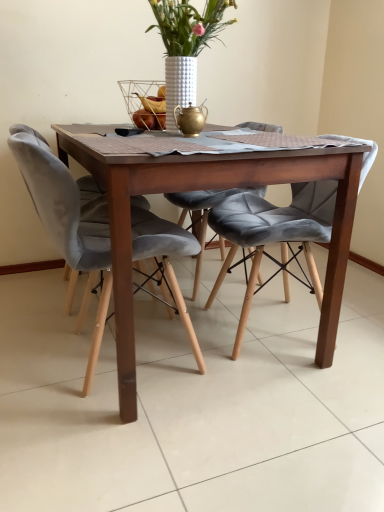
Question: Is white textured vase at upper center beside wooden table at center?

Choices:
 (A) yes
 (B) no

Answer: (B)

Question: Does white textured vase at upper center appear on the left side of wooden table at center?

Choices:
 (A) no
 (B) yes

Answer: (A)

Question: Is wooden table at center a part of white textured vase at upper center?

Choices:
 (A) yes
 (B) no

Answer: (B)

Question: Is white textured vase at upper center thinner than wooden table at center?

Choices:
 (A) yes
 (B) no

Answer: (A)

Question: From a real-world perspective, is white textured vase at upper center located beneath wooden table at center?

Choices:
 (A) yes
 (B) no

Answer: (B)

Question: Is wooden table at center wider or thinner than velvet grey chair at left, the 1th chair in the left-to-right sequence?

Choices:
 (A) thin
 (B) wide

Answer: (B)

Question: From their relative heights in the image, would you say wooden table at center is taller or shorter than velvet grey chair at left, the 2th chair from the right?

Choices:
 (A) short
 (B) tall

Answer: (A)

Question: Choose the correct answer: Is wooden table at center inside velvet grey chair at left, the 1th chair in the left-to-right sequence, or outside it?

Choices:
 (A) outside
 (B) inside

Answer: (A)

Question: Is wooden table at center bigger or smaller than velvet grey chair at left, the 1th chair in the left-to-right sequence?

Choices:
 (A) small
 (B) big

Answer: (B)

Question: Is velvet grey chair at left, the 2th chair from the right, situated inside wooden table at center or outside?

Choices:
 (A) inside
 (B) outside

Answer: (A)

Question: From a real-world perspective, relative to wooden table at center, is velvet grey chair at left, the 1th chair in the left-to-right sequence, vertically above or below?

Choices:
 (A) below
 (B) above

Answer: (B)

Question: Is point (178, 303) positioned closer to the camera than point (334, 253)?

Choices:
 (A) closer
 (B) farther

Answer: (B)

Question: From the image's perspective, is velvet grey chair at left, the 1th chair in the left-to-right sequence, positioned above or below wooden table at center?

Choices:
 (A) above
 (B) below

Answer: (B)

Question: Is velvet grey chair at left, the 1th chair in the left-to-right sequence, bigger or smaller than velvet grey chair at center, the first chair when ordered from right to left?

Choices:
 (A) small
 (B) big

Answer: (B)

Question: Considering the relative positions of velvet grey chair at left, the 1th chair in the left-to-right sequence, and velvet grey chair at center, the second chair positioned from the left, in the image provided, is velvet grey chair at left, the 1th chair in the left-to-right sequence, to the left or to the right of velvet grey chair at center, the second chair positioned from the left,?

Choices:
 (A) left
 (B) right

Answer: (A)